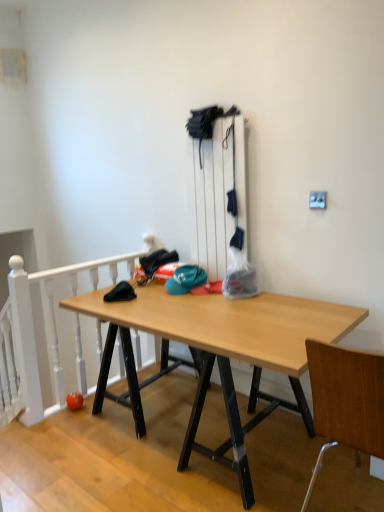
Question: Considering the relative positions of wooden at right and teal fabric cap at center in the image provided, is wooden at right to the right of teal fabric cap at center from the viewer's perspective?

Choices:
 (A) yes
 (B) no

Answer: (A)

Question: Can we say wooden at right lies outside teal fabric cap at center?

Choices:
 (A) yes
 (B) no

Answer: (A)

Question: Can you confirm if wooden at right is smaller than teal fabric cap at center?

Choices:
 (A) yes
 (B) no

Answer: (B)

Question: Is wooden at right not near teal fabric cap at center?

Choices:
 (A) no
 (B) yes

Answer: (B)

Question: Can you confirm if wooden at right is thinner than teal fabric cap at center?

Choices:
 (A) no
 (B) yes

Answer: (A)

Question: Is teal fabric cap at center spatially inside wooden desk at center, or outside of it?

Choices:
 (A) outside
 (B) inside

Answer: (A)

Question: Considering the positions of teal fabric cap at center and wooden desk at center in the image, is teal fabric cap at center bigger or smaller than wooden desk at center?

Choices:
 (A) big
 (B) small

Answer: (B)

Question: Based on their positions, is teal fabric cap at center located to the left or right of wooden desk at center?

Choices:
 (A) right
 (B) left

Answer: (A)

Question: In terms of height, does teal fabric cap at center look taller or shorter compared to wooden desk at center?

Choices:
 (A) short
 (B) tall

Answer: (B)

Question: From the image's perspective, is wooden at right above or below teal fabric cap at center?

Choices:
 (A) below
 (B) above

Answer: (A)

Question: From a real-world perspective, relative to teal fabric cap at center, is wooden at right vertically above or below?

Choices:
 (A) above
 (B) below

Answer: (B)

Question: Is wooden at right bigger or smaller than teal fabric cap at center?

Choices:
 (A) small
 (B) big

Answer: (B)

Question: Is point (334, 409) closer or farther from the camera than point (193, 266)?

Choices:
 (A) farther
 (B) closer

Answer: (B)

Question: Visually, is teal fabric cap at center positioned to the left or to the right of white painted wood at left?

Choices:
 (A) left
 (B) right

Answer: (B)

Question: Is teal fabric cap at center spatially inside white painted wood at left, or outside of it?

Choices:
 (A) outside
 (B) inside

Answer: (A)